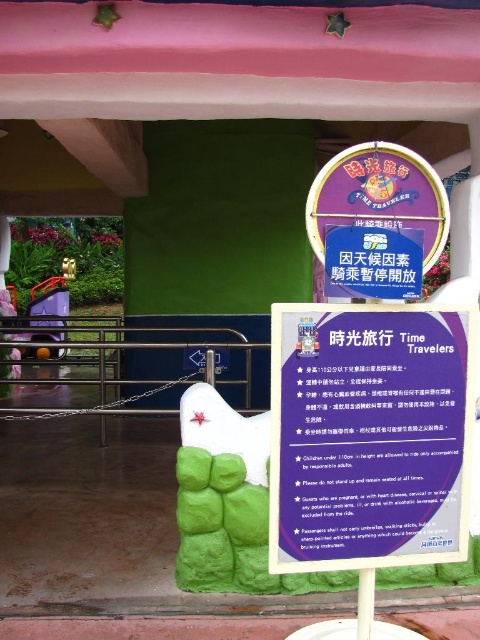
Who is taller, purple paper sign at center or purple glossy sign at center?

purple paper sign at center

Is purple paper sign at center to the left of purple glossy sign at center from the viewer's perspective?

Correct, you'll find purple paper sign at center to the left of purple glossy sign at center.

Where is `purple paper sign at center`? The height and width of the screenshot is (640, 480). purple paper sign at center is located at coordinates point(370,435).